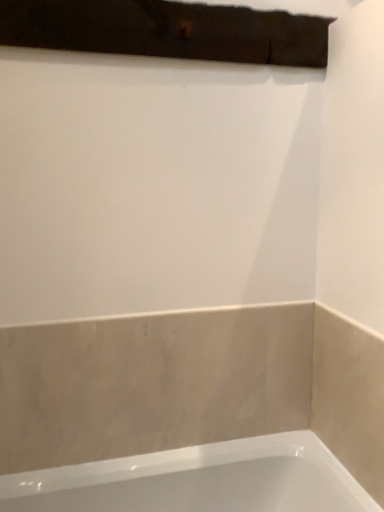
Question: Should I look upward or downward to see white glossy bathtub at lower center?

Choices:
 (A) down
 (B) up

Answer: (A)